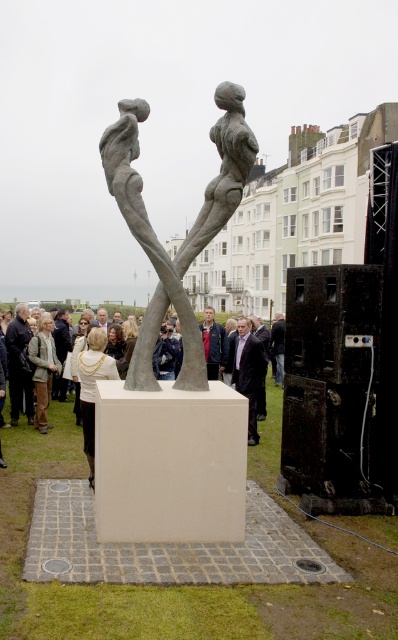
You are standing in front of the sculpture and want to know which of the two points, point (278, 324) or point (107, 317), is closer to you. Can you determine this based on their positions?

Point (278, 324) is further to the viewer than point (107, 317), so the closer point to you is point (107, 317).

Looking at this image, you are an event organizer who needs to arrange a pathway between the two people wearing the jackets. Since the dark brown leather jacket at center is to the right of the light brown leather jacket at center, which jacket should you place on the left side of the pathway to ensure proper alignment?

The light brown leather jacket at center should be placed on the left side of the pathway since the dark brown leather jacket at center is positioned to its right.